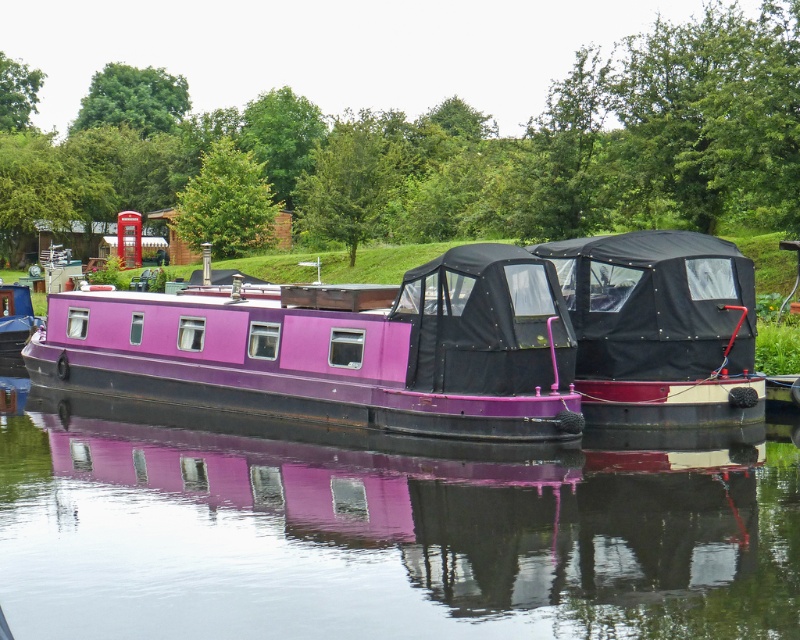
Question: Which point is closer to the camera?

Choices:
 (A) black matte boat at center
 (B) purple glossy barge at center
 (C) purple glossy boat at center

Answer: (C)

Question: Which point is closer to the camera?

Choices:
 (A) purple glossy barge at center
 (B) black matte boat at center
 (C) purple glossy boat at center

Answer: (C)

Question: Observing the image, what is the correct spatial positioning of purple glossy boat at center in reference to black matte boat at center?

Choices:
 (A) left
 (B) right

Answer: (A)

Question: Considering the real-world distances, which object is closest to the black matte boat at center?

Choices:
 (A) purple glossy barge at center
 (B) purple glossy boat at center

Answer: (A)

Question: Is purple glossy boat at center smaller than black matte boat at center?

Choices:
 (A) yes
 (B) no

Answer: (B)

Question: Is purple glossy barge at center bigger than black matte boat at center?

Choices:
 (A) no
 (B) yes

Answer: (B)